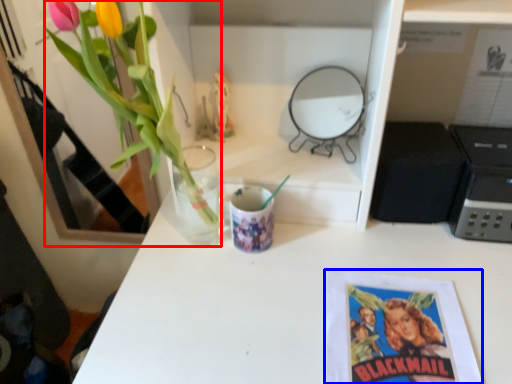
Question: Which point is further to the camera, floral arrangement (highlighted by a red box) or book cover (highlighted by a blue box)?

Choices:
 (A) floral arrangement
 (B) book cover

Answer: (B)